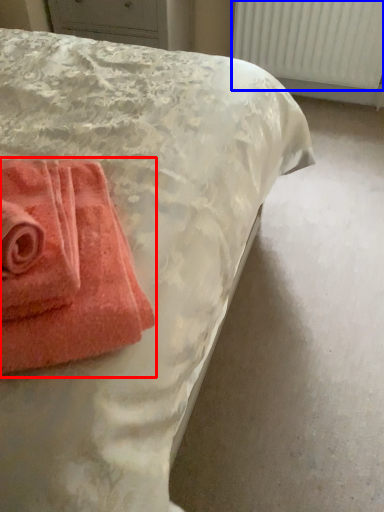
Question: Which object is further to the camera taking this photo, towel (highlighted by a red box) or radiator (highlighted by a blue box)?

Choices:
 (A) towel
 (B) radiator

Answer: (B)